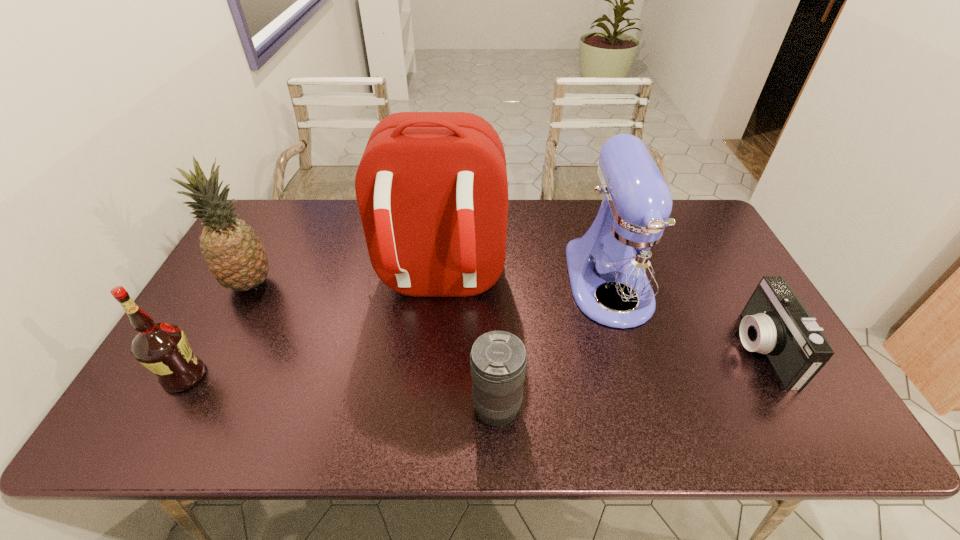
Where is `alcohol positioned at the left edge`? The height and width of the screenshot is (540, 960). alcohol positioned at the left edge is located at coordinates (163, 348).

The image size is (960, 540). I want to click on object at the right edge, so click(x=776, y=323).

Locate an element on the screen. This screenshot has height=540, width=960. vacant space at the far edge of the desktop is located at coordinates pos(353,219).

In the image, there is a desktop. At what (x,y) coordinates should I click in order to perform the action: click on free space at the near edge. Please return your answer as a coordinate pair (x, y). The width and height of the screenshot is (960, 540). Looking at the image, I should click on (197, 442).

Where is `vacant area at the left edge of the desktop`? The height and width of the screenshot is (540, 960). vacant area at the left edge of the desktop is located at coordinates (204, 300).

This screenshot has width=960, height=540. Identify the location of vacant space at the right edge of the desktop. (720, 298).

The height and width of the screenshot is (540, 960). What are the coordinates of `vacant space at the near left corner` in the screenshot? It's located at (125, 429).

This screenshot has height=540, width=960. In order to click on free space that is in between the second shortest object and the pineapple in this screenshot , I will do `click(372, 346)`.

Find the location of `empty space that is in between the mixer and the rightmost object`. empty space that is in between the mixer and the rightmost object is located at coordinates (685, 316).

Where is `vacant space that is in between the pineapple and the second shortest object`? This screenshot has height=540, width=960. vacant space that is in between the pineapple and the second shortest object is located at coordinates (372, 346).